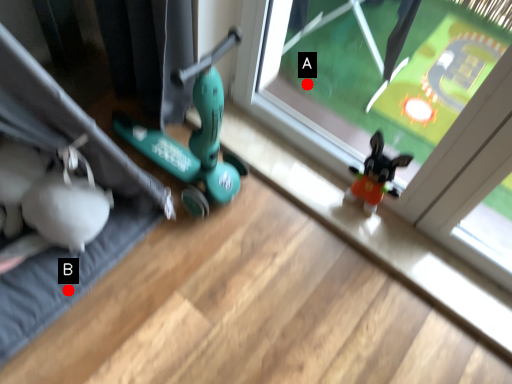
Question: Two points are circled on the image, labeled by A and B beside each circle. Among these points, which one is nearest to the camera?

Choices:
 (A) A is closer
 (B) B is closer

Answer: (B)